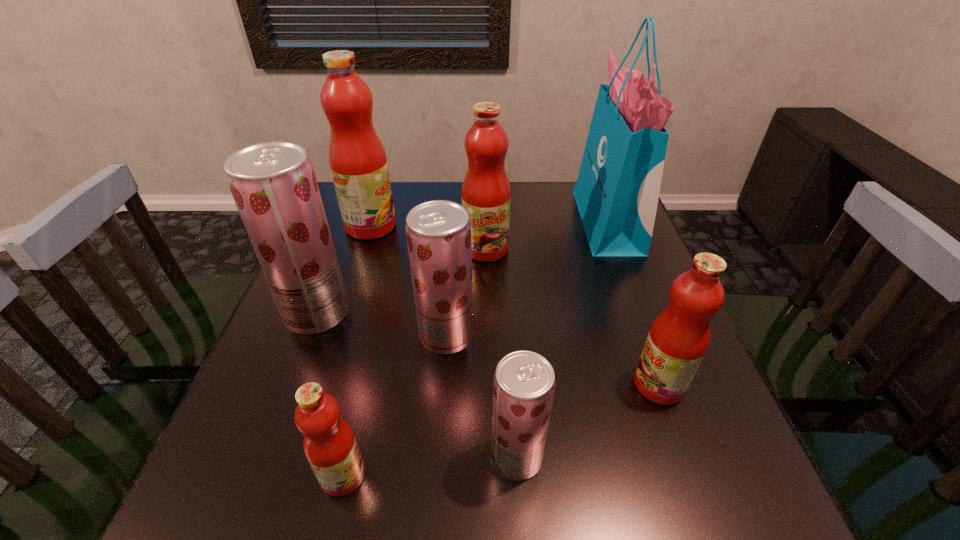
This screenshot has width=960, height=540. In order to click on shopping bag in this screenshot , I will do `click(617, 190)`.

Where is `the biggest pink fruit juice`? The image size is (960, 540). the biggest pink fruit juice is located at coordinates (357, 159).

Identify the location of the biggest strawberry fruit juice. (273, 184).

Locate an element on the screen. The width and height of the screenshot is (960, 540). the third smallest pink fruit juice is located at coordinates (486, 193).

The image size is (960, 540). Find the location of `the second biggest strawberry fruit juice`. the second biggest strawberry fruit juice is located at coordinates (438, 232).

You are a GUI agent. You are given a task and a screenshot of the screen. Output one action in this format:
    pyautogui.click(x=<x>, y=<y>)
    Task: Click on the rightmost fruit juice
    The width and height of the screenshot is (960, 540).
    Given the screenshot: What is the action you would take?
    pyautogui.click(x=679, y=337)

Find the location of a particular element. This screenshot has height=540, width=960. the third nearest object is located at coordinates (679, 337).

Identify the location of the nearest pink fruit juice. (330, 446).

Where is `the nearest strawberry fruit juice`? the nearest strawberry fruit juice is located at coordinates (524, 383).

Find the location of `the smallest strawberry fruit juice`. the smallest strawberry fruit juice is located at coordinates (524, 383).